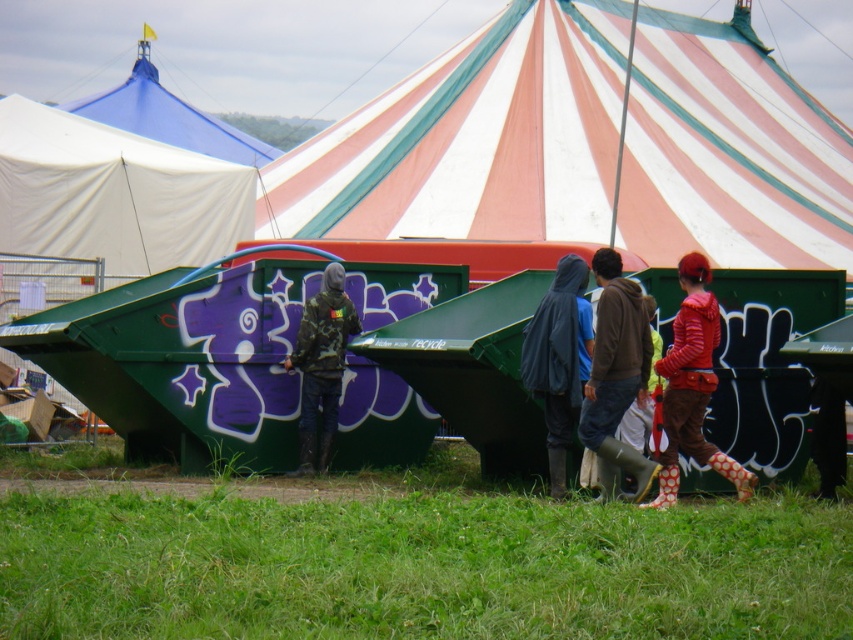
The height and width of the screenshot is (640, 853). What are the coordinates of `brown leather jacket at center` in the screenshot? It's located at (616, 378).

Which is behind, point (583, 412) or point (299, 324)?

The point (299, 324) is behind.

The image size is (853, 640). Find the location of `brown leather jacket at center`. brown leather jacket at center is located at coordinates (616, 378).

Measure the distance between point (688, 356) and camera.

A distance of 58.19 feet exists between point (688, 356) and camera.

Image resolution: width=853 pixels, height=640 pixels. In order to click on striped hoodie at center in this screenshot , I will do `click(692, 387)`.

Does point (679, 394) come closer to viewer compared to point (592, 339)?

Yes, it is.

In order to click on striped hoodie at center in this screenshot , I will do `click(692, 387)`.

Where is `striped canvas tent at center`? The width and height of the screenshot is (853, 640). striped canvas tent at center is located at coordinates (584, 145).

Which of these two, striped canvas tent at center or dark blue hooded jacket at center, stands taller?

striped canvas tent at center

Between point (642, 28) and point (544, 365), which one is positioned behind?

Positioned behind is point (642, 28).

Where is `striped canvas tent at center`? striped canvas tent at center is located at coordinates (584, 145).